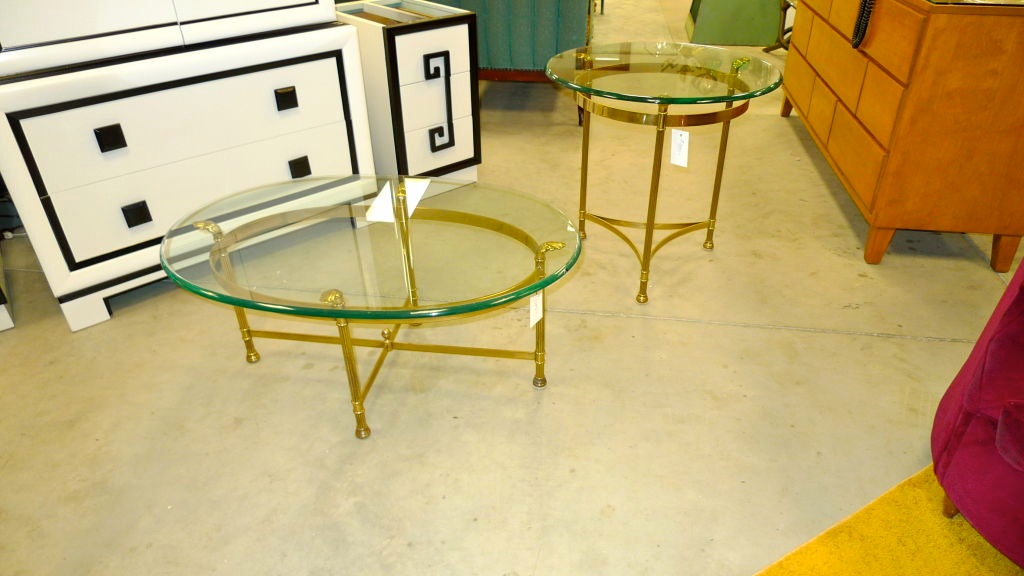
This screenshot has width=1024, height=576. Identify the location of red velvet fabric. (987, 472).